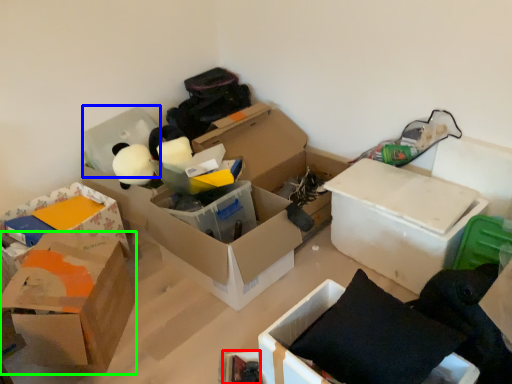
Question: Considering the real-world distances, which object is farthest from storage box (highlighted by a red box)? storage box (highlighted by a blue box) or box (highlighted by a green box)?

Choices:
 (A) storage box
 (B) box

Answer: (A)